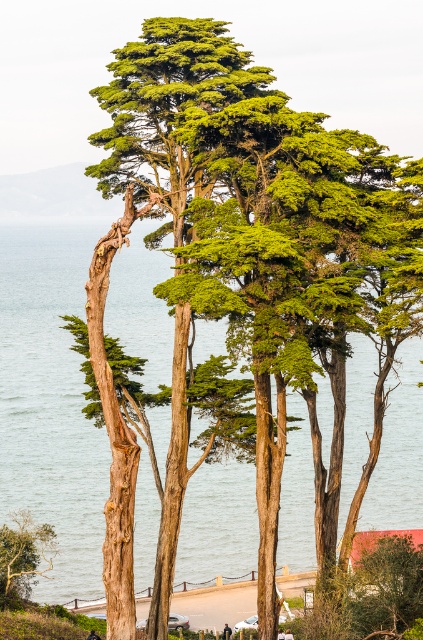
Looking at this image, is green water at center taller than green leafy tree at lower left?

Yes.

Image resolution: width=423 pixels, height=640 pixels. What do you see at coordinates (51, 403) in the screenshot?
I see `green water at center` at bounding box center [51, 403].

Measure the distance between green water at center and camera.

The distance of green water at center from camera is 119.56 meters.

At what (x,y) coordinates should I click in order to perform the action: click on green water at center. Please return your answer as a coordinate pair (x, y). The image size is (423, 640). Looking at the image, I should click on (51, 403).